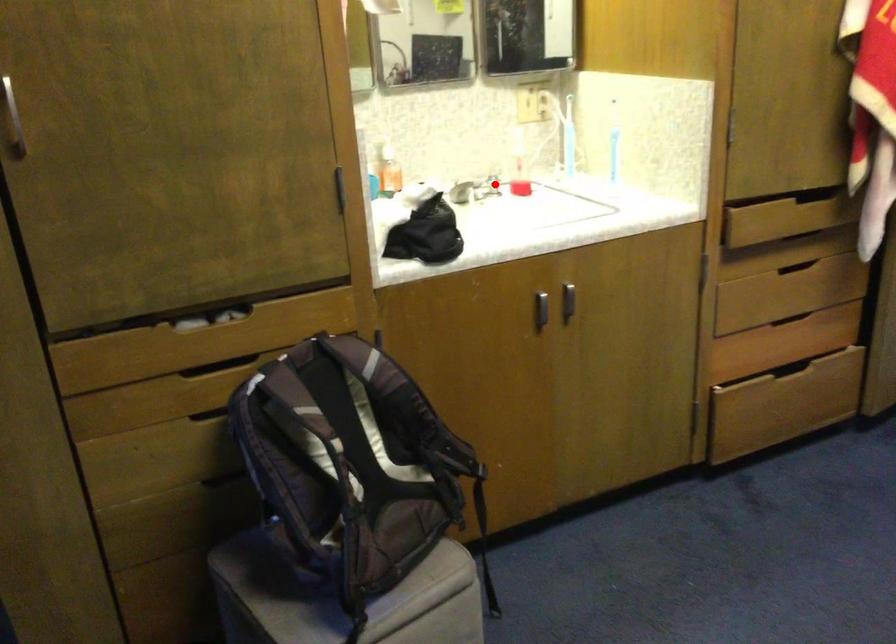
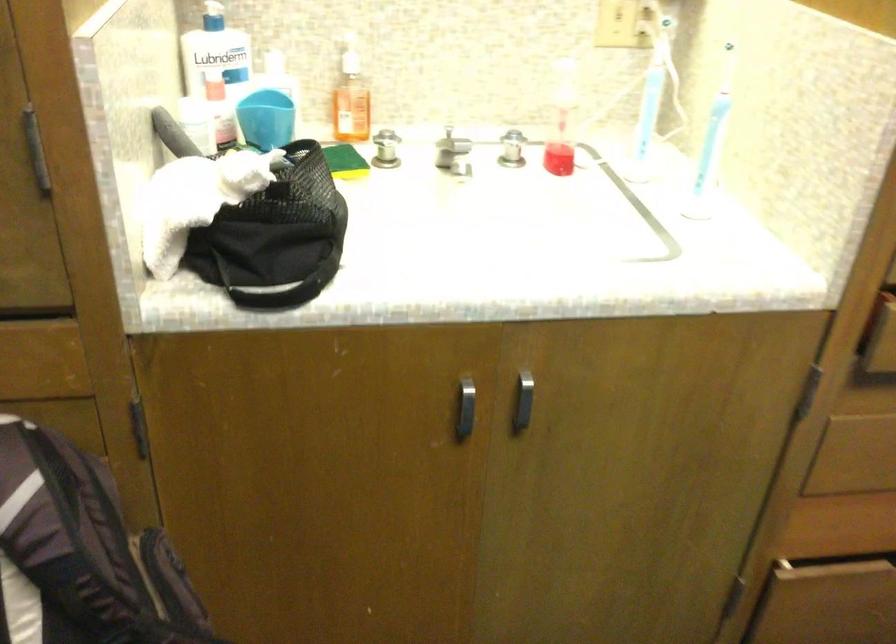
Locate, in the second image, the point that corresponds to the highlighted location in the first image.

(512, 149)